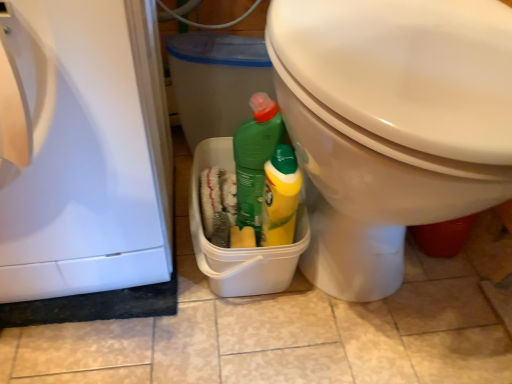
Question: Is white glossy toilet at right bigger than white glossy dishwasher at left?

Choices:
 (A) yes
 (B) no

Answer: (A)

Question: Can you confirm if white glossy toilet at right is positioned to the left of white glossy dishwasher at left?

Choices:
 (A) yes
 (B) no

Answer: (B)

Question: From the image's perspective, is white glossy toilet at right beneath white glossy dishwasher at left?

Choices:
 (A) yes
 (B) no

Answer: (B)

Question: Can you confirm if white glossy toilet at right is thinner than white glossy dishwasher at left?

Choices:
 (A) yes
 (B) no

Answer: (B)

Question: Is white glossy toilet at right to the right of white glossy dishwasher at left from the viewer's perspective?

Choices:
 (A) yes
 (B) no

Answer: (A)

Question: Is white glossy toilet at right further to the viewer compared to white glossy dishwasher at left?

Choices:
 (A) no
 (B) yes

Answer: (B)

Question: Is white glossy toilet at right at the back of white glossy dishwasher at left?

Choices:
 (A) yes
 (B) no

Answer: (B)

Question: Does white glossy dishwasher at left have a greater width compared to white glossy toilet at right?

Choices:
 (A) yes
 (B) no

Answer: (B)

Question: Considering the relative positions of white glossy dishwasher at left and white glossy toilet at right in the image provided, is white glossy dishwasher at left to the left of white glossy toilet at right from the viewer's perspective?

Choices:
 (A) yes
 (B) no

Answer: (A)

Question: Is white glossy dishwasher at left placed right next to white glossy toilet at right?

Choices:
 (A) yes
 (B) no

Answer: (B)

Question: Can you confirm if white glossy dishwasher at left is taller than white glossy toilet at right?

Choices:
 (A) no
 (B) yes

Answer: (A)

Question: From a real-world perspective, is white glossy dishwasher at left below white glossy toilet at right?

Choices:
 (A) no
 (B) yes

Answer: (A)

Question: From the image's perspective, is white glossy dishwasher at left above or below white glossy toilet at right?

Choices:
 (A) above
 (B) below

Answer: (B)